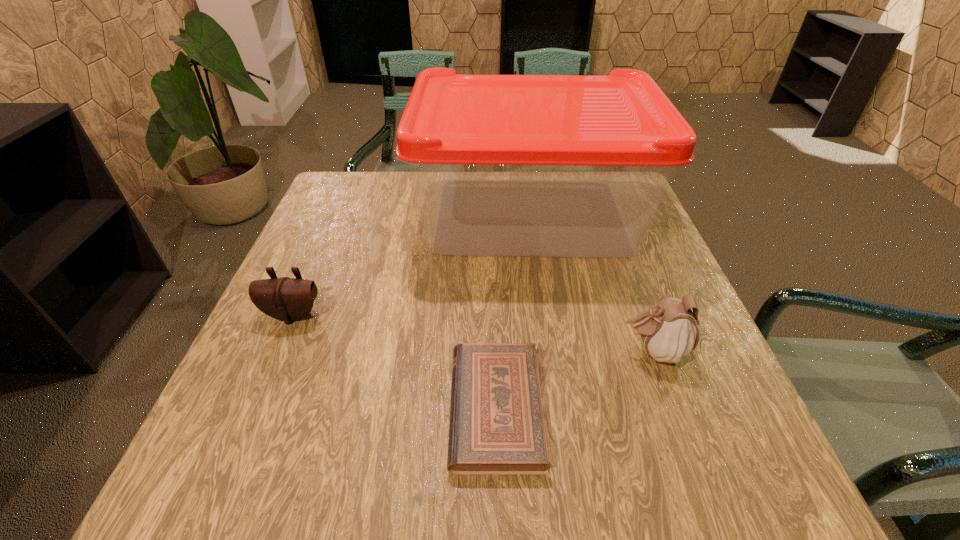
Where is `free region located 0.060m on the front-facing side of the nearer pouch`? free region located 0.060m on the front-facing side of the nearer pouch is located at coordinates (588, 351).

Locate an element on the screen. The image size is (960, 540). free location located 0.050m with the flap open on the third tallest object is located at coordinates (279, 346).

The width and height of the screenshot is (960, 540). I want to click on free space located 0.160m on the spine side of the shortest object, so click(356, 408).

Locate an element on the screen. vacant area situated 0.280m on the spine side of the shortest object is located at coordinates (285, 408).

I want to click on free space located 0.070m on the spine side of the shortest object, so click(x=410, y=408).

This screenshot has height=540, width=960. Identify the location of object situated at the far edge. (503, 165).

Where is `object present at the near edge`? The image size is (960, 540). object present at the near edge is located at coordinates (496, 426).

Image resolution: width=960 pixels, height=540 pixels. I want to click on object present at the left edge, so click(x=288, y=299).

You are a GUI agent. You are given a task and a screenshot of the screen. Output one action in this format:
    pyautogui.click(x=<x>, y=<y>)
    Task: Click on the tray present at the right edge
    Image resolution: width=960 pixels, height=540 pixels.
    Given the screenshot: What is the action you would take?
    pyautogui.click(x=503, y=165)

The image size is (960, 540). Find the location of `pouch present at the right edge`. pouch present at the right edge is located at coordinates (669, 331).